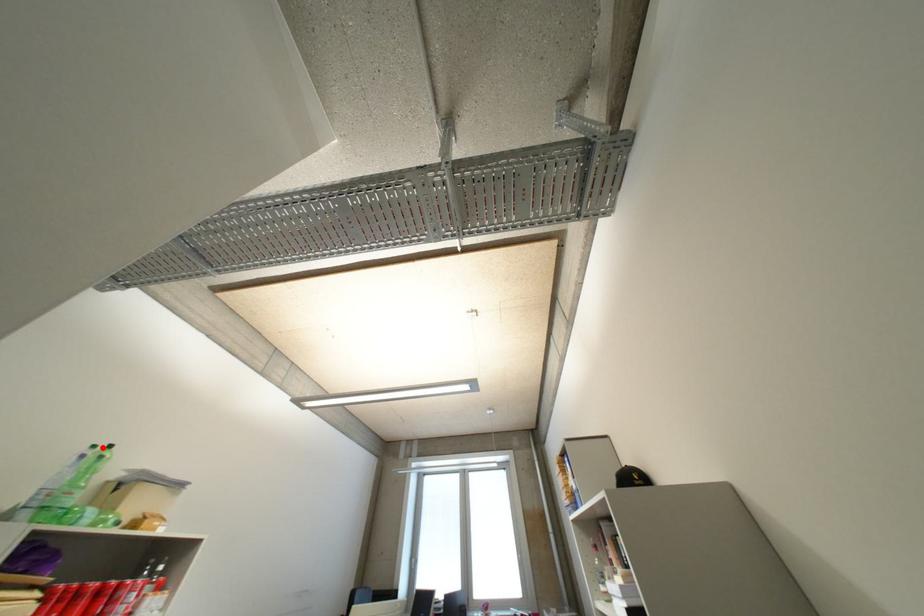
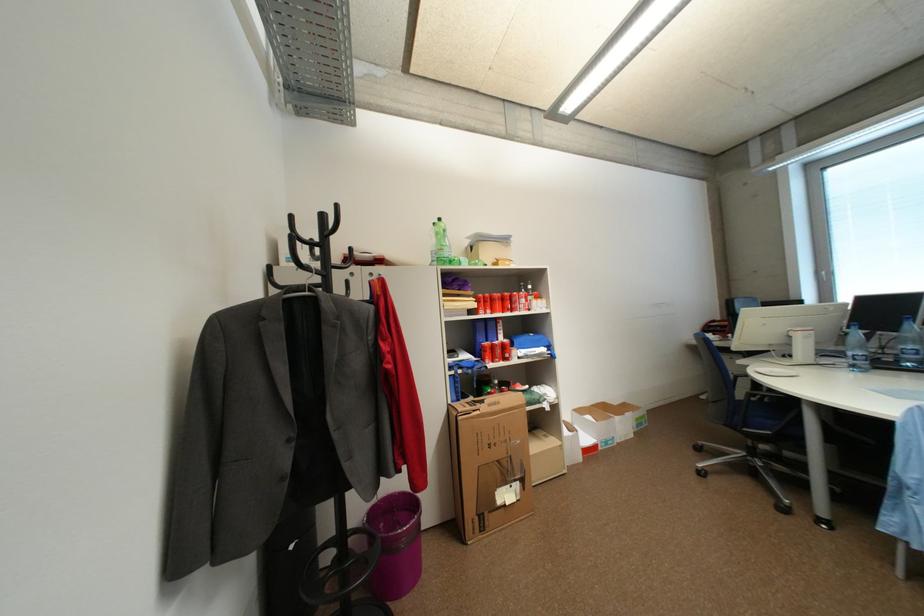
In the second image, find the point that corresponds to the highlighted location in the first image.

(443, 225)